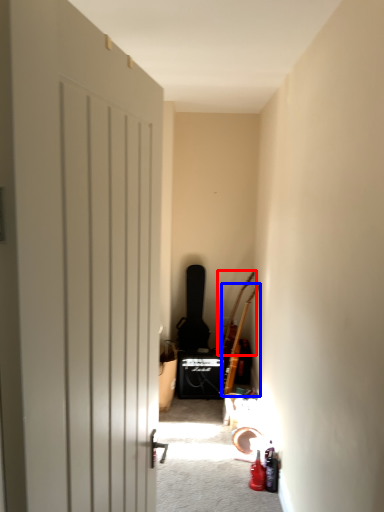
Question: Which of the following is the closest to the observer, guitar (highlighted by a red box) or guitar (highlighted by a blue box)?

Choices:
 (A) guitar
 (B) guitar

Answer: (B)